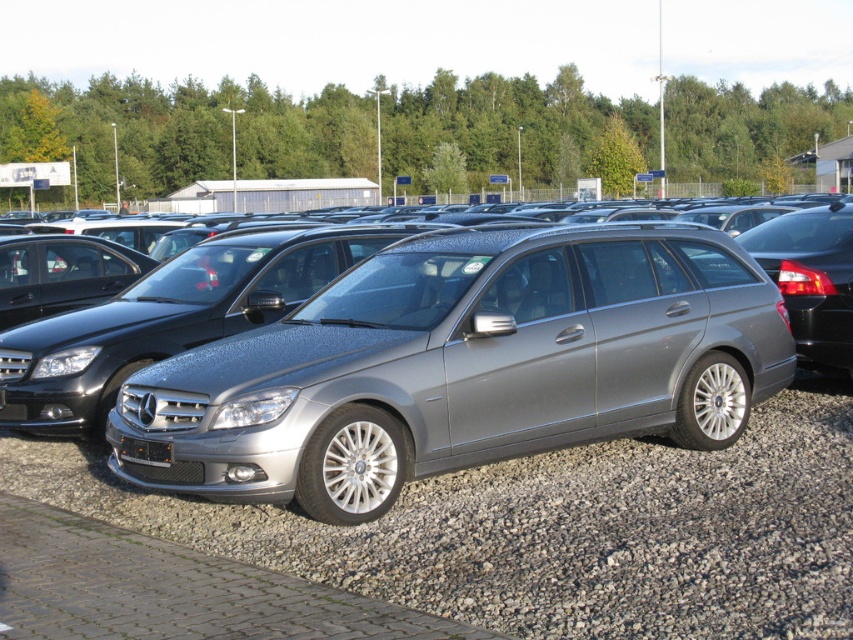
You are a delivery person trying to park a new car in the parking lot. The satin metallic station wagon at center is blocking the entrance. Can you drive over the gray gravel at center to go around it?

The satin metallic station wagon at center is taller than gray gravel at center, so you cannot drive over the gray gravel at center because the gravel is lower than the car, making it impossible to navigate over it.

You are a delivery person with a cart that is 1.5 meters wide. You need to move from the satin metallic station wagon at center to the gray gravel at center. Can your cart fit through the space between them?

The distance between the satin metallic station wagon at center and the gray gravel at center is 1.67 meters. Since the cart is 1.5 meters wide, it can fit through the space as the available width is greater than the cart.